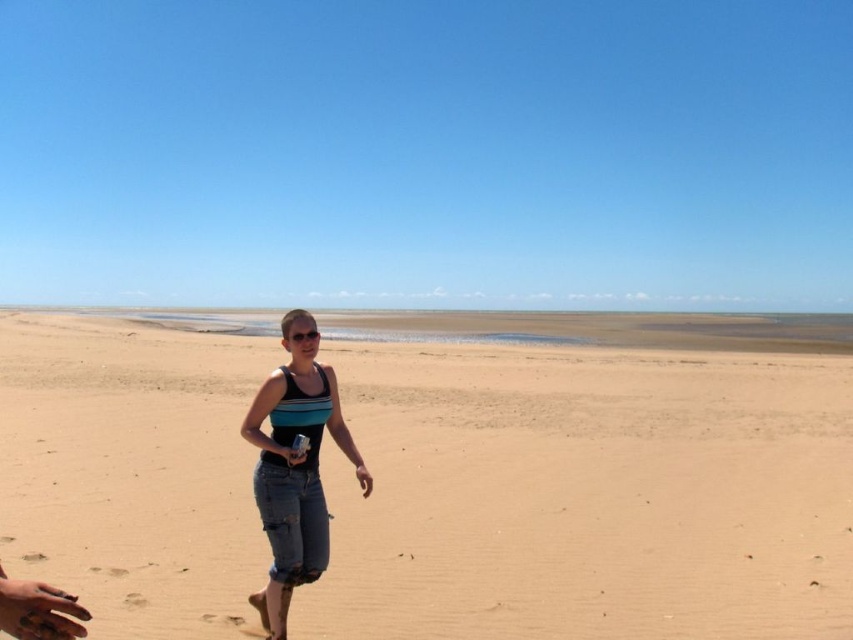
Does smooth tan skin at lower center appear under smooth plastic bottle at center?

Indeed, smooth tan skin at lower center is positioned under smooth plastic bottle at center.

Can you confirm if smooth tan skin at lower center is positioned to the right of smooth plastic bottle at center?

Correct, you'll find smooth tan skin at lower center to the right of smooth plastic bottle at center.

Who is more distant from viewer, (370, 480) or (288, 464)?

Positioned behind is point (370, 480).

You are a GUI agent. You are given a task and a screenshot of the screen. Output one action in this format:
    pyautogui.click(x=<x>, y=<y>)
    Task: Click on the smooth tan skin at lower center
    The width and height of the screenshot is (853, 640).
    Given the screenshot: What is the action you would take?
    pyautogui.click(x=363, y=477)

Who is shorter, denim shorts at center or smooth plastic bottle at center?

smooth plastic bottle at center is shorter.

Is point (305, 356) positioned behind point (291, 465)?

Yes.

Where is `denim shorts at center`? The width and height of the screenshot is (853, 640). denim shorts at center is located at coordinates (293, 467).

Does brown sandy beach at center come behind smooth plastic bottle at center?

Yes, brown sandy beach at center is behind smooth plastic bottle at center.

Which of these two, brown sandy beach at center or smooth plastic bottle at center, stands shorter?

With less height is smooth plastic bottle at center.

Identify the location of brown sandy beach at center. This screenshot has height=640, width=853. (587, 496).